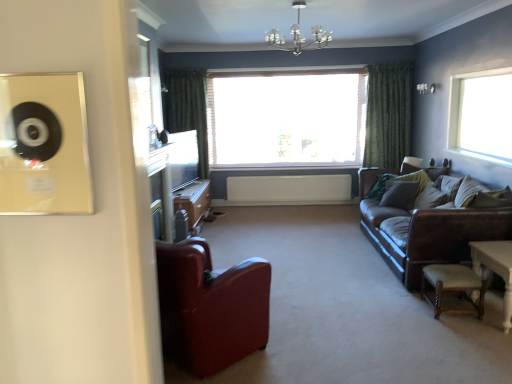
Question: Which is correct: wooden cabinet at center is inside white wooden window at center, marked as the 2th window in a front-to-back arrangement, or outside of it?

Choices:
 (A) outside
 (B) inside

Answer: (A)

Question: From the image's perspective, is wooden cabinet at center positioned above or below white wooden window at center, which appears as the 2th window when viewed from the right?

Choices:
 (A) below
 (B) above

Answer: (A)

Question: Which is farther from the beige woven stool at lower right?

Choices:
 (A) brown leather couch at right
 (B) leather armchair at lower left
 (C) green velvet curtain at left, which is counted as the 1th curtain, starting from the left
 (D) white wooden table at lower right
 (E) white plastic radiator at center

Answer: (C)

Question: Estimate the real-world distances between objects in this image. Which object is closer to the transparent glass window at upper right, which appears as the first window when viewed from the front?

Choices:
 (A) green fabric pillow at center, the 2th pillow in the right-to-left sequence
 (B) brown fabric pillow at right, acting as the second pillow starting from the back
 (C) brown leather couch at right
 (D) white plastic radiator at center
 (E) green textured curtain at center, which ranks as the second curtain in left-to-right order

Answer: (B)